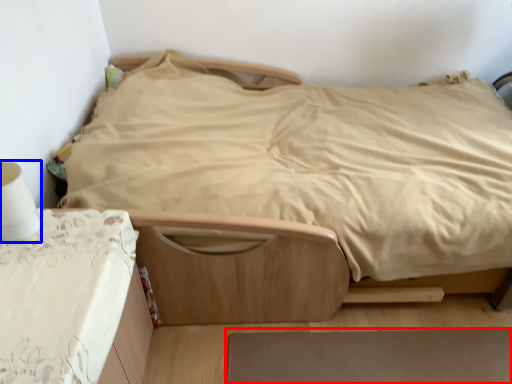
Question: Which object appears farthest to the camera in this image, plain (highlighted by a red box) or table lamp (highlighted by a blue box)?

Choices:
 (A) plain
 (B) table lamp

Answer: (A)